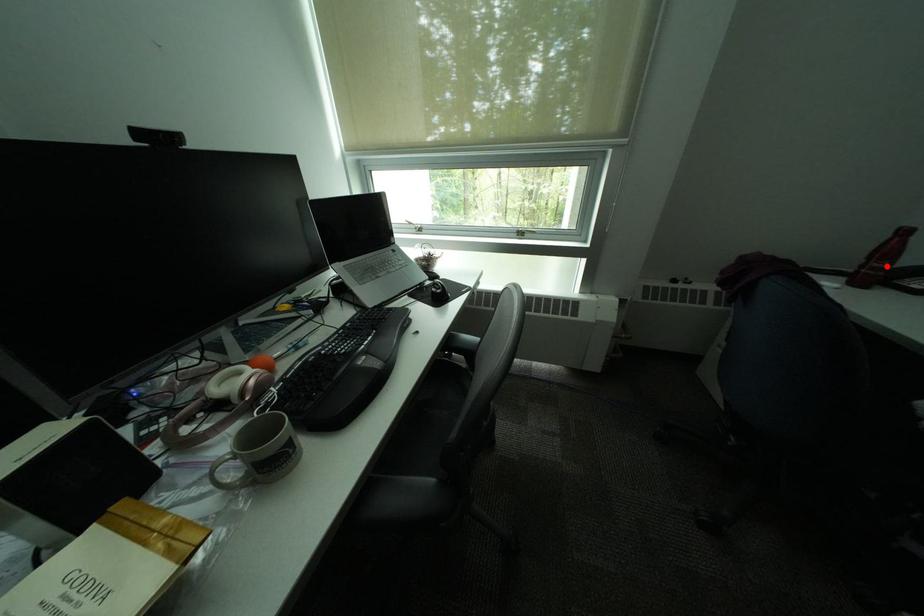
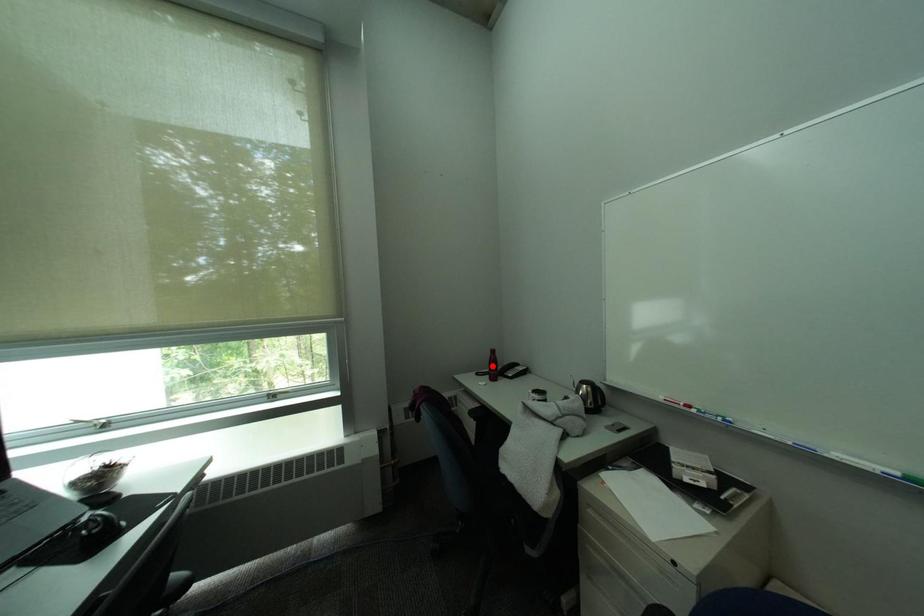
I am providing you with two images of the same scene from different viewpoints. A red point is marked on the first image and another point is marked on the second image. Do the highlighted points in image1 and image2 indicate the same real-world spot?

No